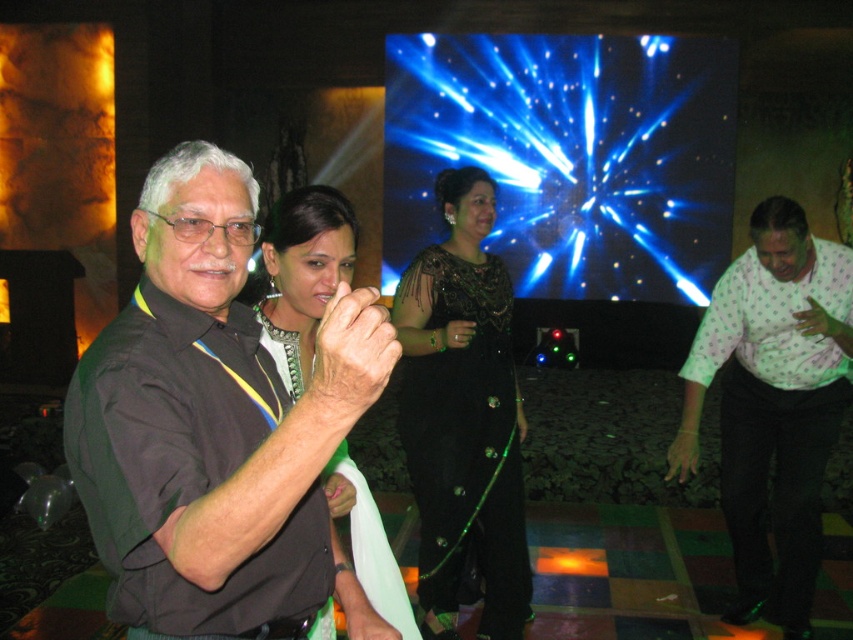
Which is above, black matte shirt at center or black satin dress at center?

black matte shirt at center

Is point (236, 177) more distant than point (418, 394)?

No.

Image resolution: width=853 pixels, height=640 pixels. I want to click on black matte shirt at center, so click(216, 428).

In order to click on black matte shirt at center in this screenshot , I will do 216,428.

Is black satin dress at center shorter than green beaded necklace at center?

No, black satin dress at center is not shorter than green beaded necklace at center.

Between black satin dress at center and green beaded necklace at center, which one has more height?

black satin dress at center is taller.

Is point (523, 540) farther from viewer compared to point (259, 289)?

No, it is not.

The width and height of the screenshot is (853, 640). In order to click on black satin dress at center in this screenshot , I will do tap(463, 417).

The image size is (853, 640). What are the coordinates of `white dotted shirt at right` in the screenshot? It's located at (773, 403).

Based on the photo, does white dotted shirt at right have a larger size compared to black satin dress at center?

Yes.

You are a GUI agent. You are given a task and a screenshot of the screen. Output one action in this format:
    pyautogui.click(x=<x>, y=<y>)
    Task: Click on the white dotted shirt at right
    This screenshot has width=853, height=640.
    Given the screenshot: What is the action you would take?
    coord(773,403)